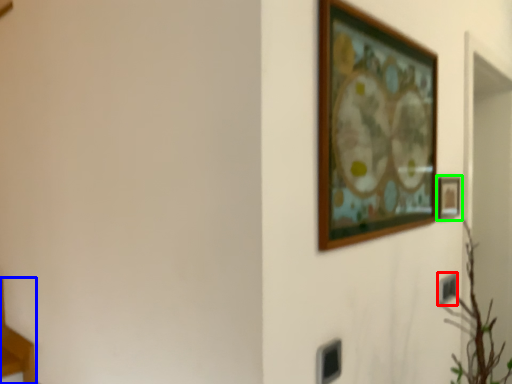
Question: Which object is positioned closest to electric outlet (highlighted by a red box)? Select from furniture (highlighted by a blue box) and picture frame (highlighted by a green box).

Choices:
 (A) furniture
 (B) picture frame

Answer: (B)